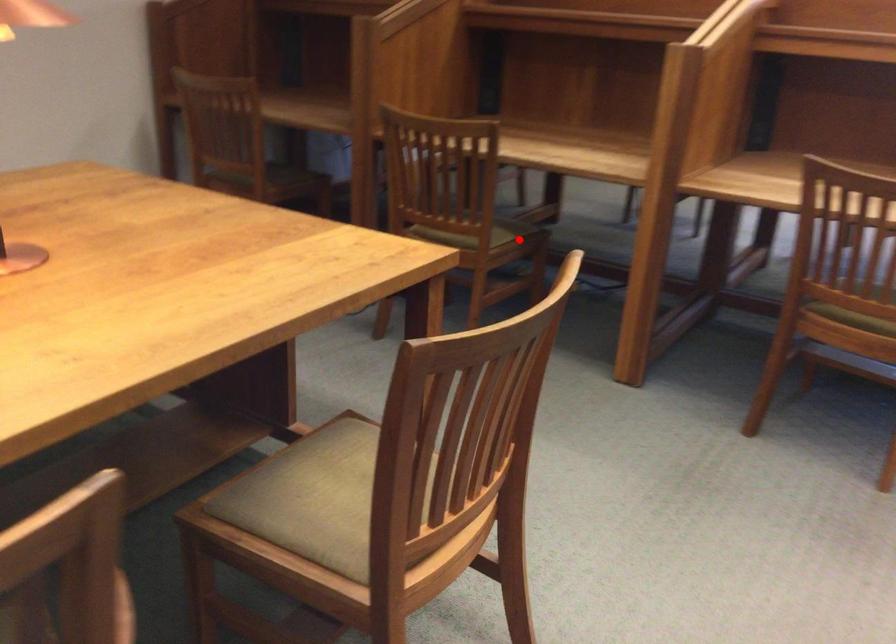
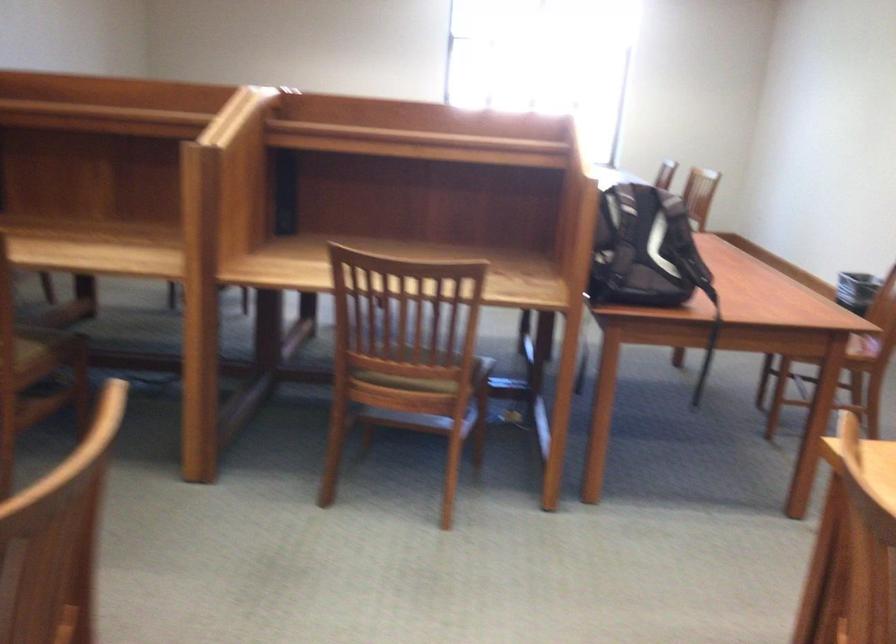
Question: I am providing you with two images of the same scene from different viewpoints. Given a red point in image1, look at the same physical point in image2. Is it:

Choices:
 (A) Closer to the viewpoint
 (B) Farther from the viewpoint

Answer: (A)